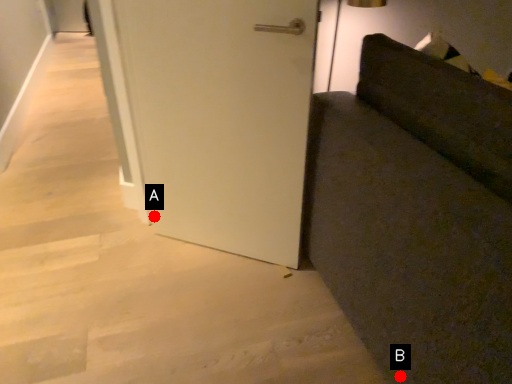
Question: Two points are circled on the image, labeled by A and B beside each circle. Which point is farther from the camera taking this photo?

Choices:
 (A) A is further
 (B) B is further

Answer: (A)